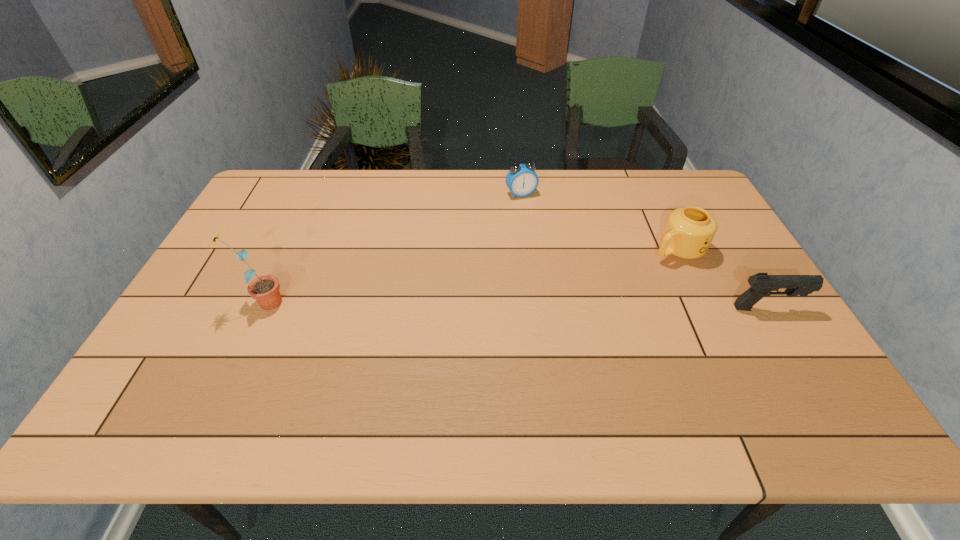
This screenshot has width=960, height=540. Find the location of `vacant area that lies between the pistol and the second object from left to right`. vacant area that lies between the pistol and the second object from left to right is located at coordinates (644, 251).

Locate which object is the second closest to the sunflower. Please provide its 2D coordinates. Your answer should be formatted as a tuple, i.e. [(x, y)], where the tuple contains the x and y coordinates of a point satisfying the conditions above.

[(689, 231)]

Identify the location of object that is the third closest one to the second object from left to right. The width and height of the screenshot is (960, 540). (265, 289).

The image size is (960, 540). What are the coordinates of `vacant space that satisfies the following two spatial constraints: 1. on the front side of the farthest object; 2. on the right side of the mug` in the screenshot? It's located at (527, 249).

At what (x,y) coordinates should I click in order to perform the action: click on free space in the image that satisfies the following two spatial constraints: 1. on the front side of the third nearest object; 2. at the barrel of the pistol. Please return your answer as a coordinate pair (x, y). The height and width of the screenshot is (540, 960). Looking at the image, I should click on (705, 308).

Locate an element on the screen. Image resolution: width=960 pixels, height=540 pixels. vacant space that satisfies the following two spatial constraints: 1. on the front side of the pistol; 2. at the barrel of the mug is located at coordinates (705, 308).

Find the location of a particular element. free region that satisfies the following two spatial constraints: 1. on the front side of the farthest object; 2. at the barrel of the pistol is located at coordinates 534,308.